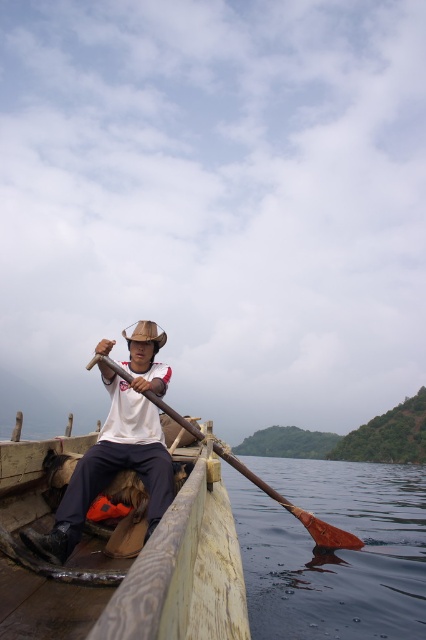
Question: Is brown wooden paddle at lower center closer to the viewer compared to brown wooden paddle at center?

Choices:
 (A) no
 (B) yes

Answer: (B)

Question: Which object appears closest to the camera in this image?

Choices:
 (A) wooden canoe at center
 (B) brown wooden paddle at lower center

Answer: (A)

Question: Which point is farther to the camera?

Choices:
 (A) (164, 461)
 (B) (253, 490)

Answer: (B)

Question: Which of the following is the farthest from the observer?

Choices:
 (A) wooden canoe at center
 (B) white matte shirt at center
 (C) brown wooden paddle at center
 (D) brown wooden paddle at lower center

Answer: (C)

Question: Can you confirm if wooden canoe at center is thinner than brown wooden paddle at center?

Choices:
 (A) no
 (B) yes

Answer: (B)

Question: Where is wooden canoe at center located in relation to white matte shirt at center in the image?

Choices:
 (A) above
 (B) below

Answer: (B)